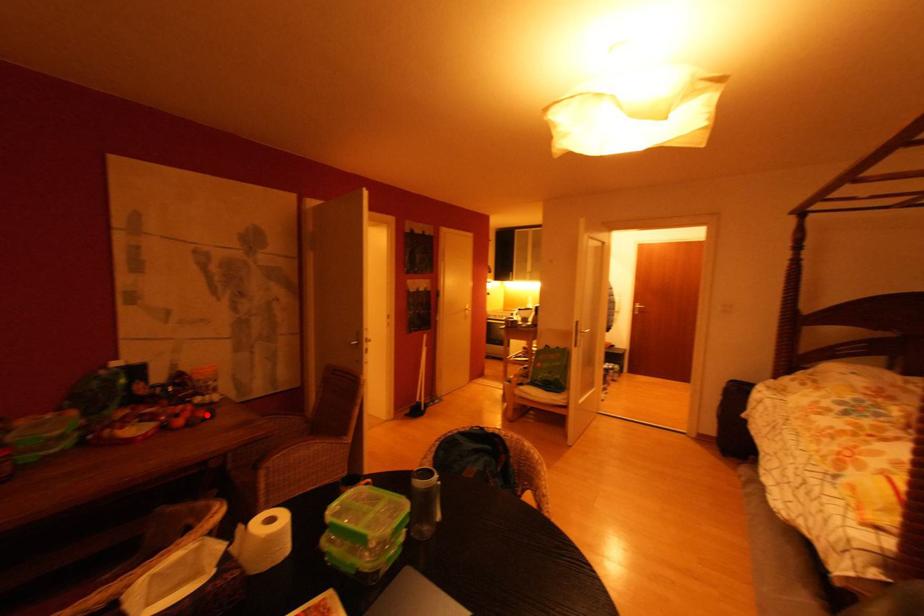
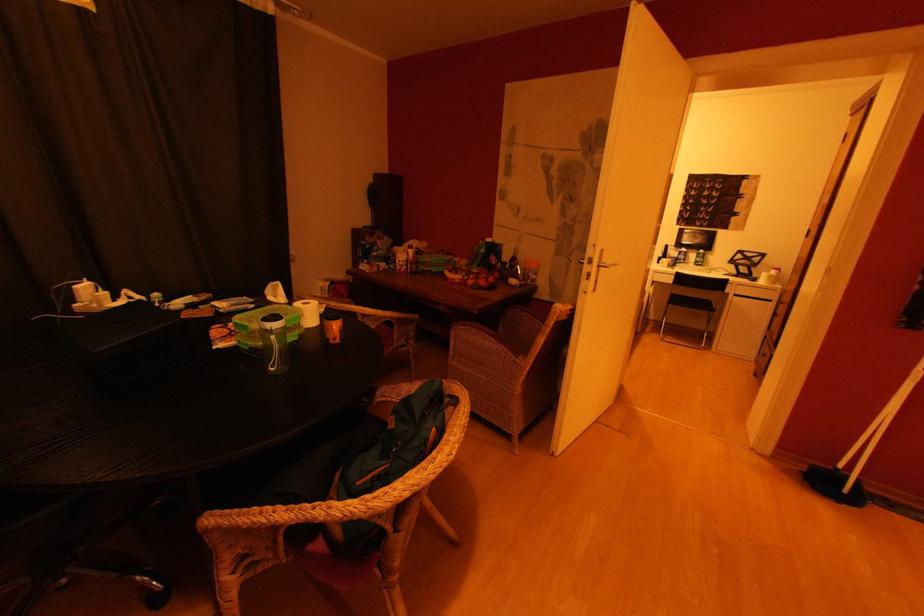
In the second image, find the point that corresponds to the highlighted location in the first image.

(488, 285)